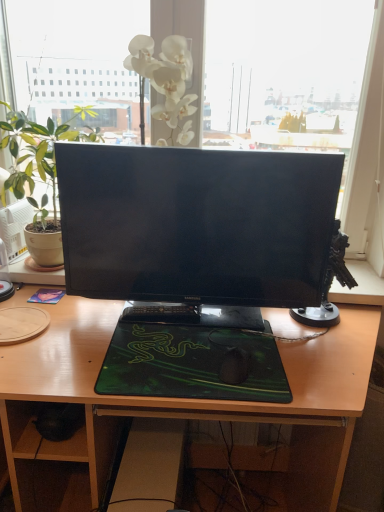
Find the location of a particular element. The width and height of the screenshot is (384, 512). free space that is to the left of black matte mouse at center is located at coordinates (175, 362).